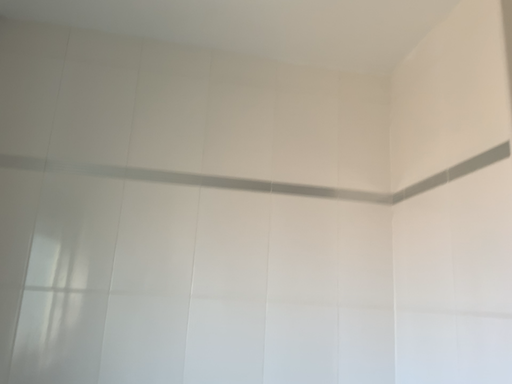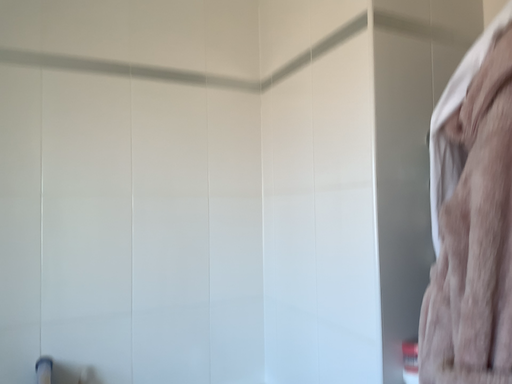
Question: Which way did the camera rotate in the video?

Choices:
 (A) rotated downward
 (B) rotated upward

Answer: (A)